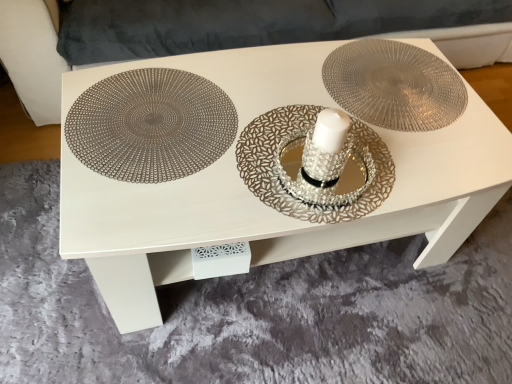
Question: Should I look upward or downward to see metallic placemat at center?

Choices:
 (A) down
 (B) up

Answer: (B)

Question: Is the position of silver textured plate at center more distant than that of suede-like gray couch at upper center?

Choices:
 (A) no
 (B) yes

Answer: (A)

Question: Is silver textured plate at center facing away from suede-like gray couch at upper center?

Choices:
 (A) yes
 (B) no

Answer: (A)

Question: Is suede-like gray couch at upper center inside silver textured plate at center?

Choices:
 (A) yes
 (B) no

Answer: (B)

Question: Is silver textured plate at center closer to the viewer compared to suede-like gray couch at upper center?

Choices:
 (A) yes
 (B) no

Answer: (A)

Question: Is silver textured plate at center outside suede-like gray couch at upper center?

Choices:
 (A) yes
 (B) no

Answer: (A)

Question: Is silver textured plate at center in contact with suede-like gray couch at upper center?

Choices:
 (A) no
 (B) yes

Answer: (A)

Question: Can you confirm if metallic placemat at center is wider than silver textured plate at center?

Choices:
 (A) no
 (B) yes

Answer: (B)

Question: Is metallic placemat at center to the right of silver textured plate at center from the viewer's perspective?

Choices:
 (A) yes
 (B) no

Answer: (B)

Question: Can silver textured plate at center be found inside metallic placemat at center?

Choices:
 (A) yes
 (B) no

Answer: (A)

Question: Can you confirm if metallic placemat at center is taller than silver textured plate at center?

Choices:
 (A) yes
 (B) no

Answer: (A)

Question: From the image's perspective, would you say metallic placemat at center is shown under silver textured plate at center?

Choices:
 (A) no
 (B) yes

Answer: (B)

Question: Considering the relative sizes of metallic placemat at center and silver textured plate at center in the image provided, is metallic placemat at center smaller than silver textured plate at center?

Choices:
 (A) no
 (B) yes

Answer: (A)

Question: Is suede-like gray couch at upper center further to camera compared to metallic woven placemat at left?

Choices:
 (A) no
 (B) yes

Answer: (B)